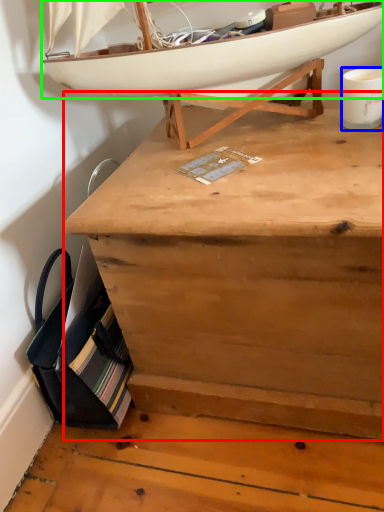
Question: Which object is the farthest from desk (highlighted by a red box)? Choose among these: coffee cup (highlighted by a blue box) or boat (highlighted by a green box).

Choices:
 (A) coffee cup
 (B) boat

Answer: (A)